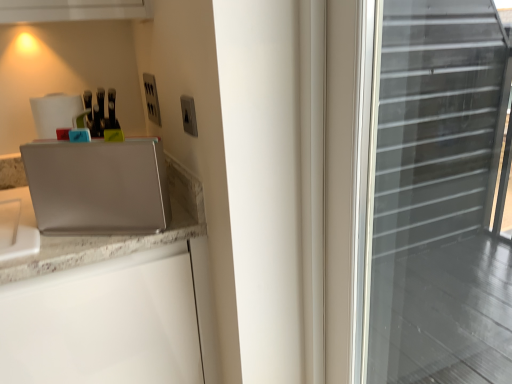
Question: Is satin silver switch at upper center, acting as the first electric outlet starting from the right, not inside satin silver laptop at left?

Choices:
 (A) yes
 (B) no

Answer: (A)

Question: Is satin silver switch at upper center, acting as the second electric outlet starting from the left, positioned far away from satin silver laptop at left?

Choices:
 (A) no
 (B) yes

Answer: (A)

Question: Is the depth of satin silver switch at upper center, acting as the second electric outlet starting from the left, greater than that of satin silver laptop at left?

Choices:
 (A) yes
 (B) no

Answer: (A)

Question: Considering the relative sizes of satin silver switch at upper center, acting as the first electric outlet starting from the right, and satin silver laptop at left in the image provided, is satin silver switch at upper center, acting as the first electric outlet starting from the right, taller than satin silver laptop at left?

Choices:
 (A) yes
 (B) no

Answer: (B)

Question: Considering the relative positions of satin silver switch at upper center, acting as the second electric outlet starting from the left, and satin silver laptop at left in the image provided, is satin silver switch at upper center, acting as the second electric outlet starting from the left, to the left of satin silver laptop at left from the viewer's perspective?

Choices:
 (A) yes
 (B) no

Answer: (B)

Question: From a real-world perspective, is satin silver outlet at upper center, which is the 2th electric outlet in front-to-back order, positioned above or below satin silver switch at upper center, acting as the second electric outlet starting from the left?

Choices:
 (A) below
 (B) above

Answer: (A)

Question: Is point (147, 114) positioned closer to the camera than point (190, 112)?

Choices:
 (A) farther
 (B) closer

Answer: (A)

Question: Choose the correct answer: Is satin silver outlet at upper center, which is the 2th electric outlet from right to left, inside satin silver switch at upper center, the first electric outlet in the front-to-back sequence, or outside it?

Choices:
 (A) outside
 (B) inside

Answer: (A)

Question: Is satin silver outlet at upper center, which is the 2th electric outlet from right to left, taller or shorter than satin silver switch at upper center, acting as the first electric outlet starting from the right?

Choices:
 (A) tall
 (B) short

Answer: (A)

Question: Considering the relative positions of satin silver switch at upper center, acting as the first electric outlet starting from the right, and satin silver outlet at upper center, which is the 2th electric outlet from right to left, in the image provided, is satin silver switch at upper center, acting as the first electric outlet starting from the right, to the left or to the right of satin silver outlet at upper center, which is the 2th electric outlet from right to left,?

Choices:
 (A) left
 (B) right

Answer: (B)

Question: From the image's perspective, is satin silver switch at upper center, the first electric outlet in the front-to-back sequence, located above or below satin silver outlet at upper center, positioned as the 1th electric outlet in back-to-front order?

Choices:
 (A) above
 (B) below

Answer: (B)

Question: Is point (183, 114) positioned closer to the camera than point (147, 97)?

Choices:
 (A) farther
 (B) closer

Answer: (B)

Question: Looking at their shapes, would you say satin silver switch at upper center, which is the 2th electric outlet from back to front, is wider or thinner than satin silver outlet at upper center, placed as the 1th electric outlet when sorted from left to right?

Choices:
 (A) thin
 (B) wide

Answer: (A)

Question: From their relative heights in the image, would you say satin silver laptop at left is taller or shorter than satin silver outlet at upper center, placed as the 1th electric outlet when sorted from left to right?

Choices:
 (A) tall
 (B) short

Answer: (A)

Question: From the image's perspective, is satin silver laptop at left positioned above or below satin silver outlet at upper center, placed as the 1th electric outlet when sorted from left to right?

Choices:
 (A) above
 (B) below

Answer: (B)